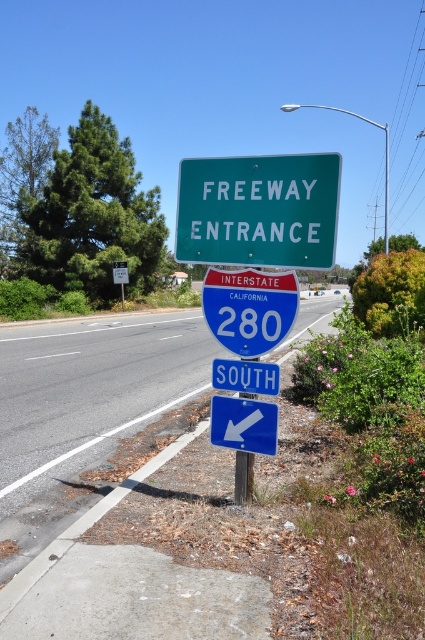
Does green matte freeway entrance sign at upper center come in front of blue glossy arrow at lower center?

No, it is not.

Which is more to the right, green matte freeway entrance sign at upper center or blue glossy arrow at lower center?

blue glossy arrow at lower center is more to the right.

Identify the location of green matte freeway entrance sign at upper center. (258, 211).

Is point (227, 317) positioned in front of point (240, 396)?

Yes, point (227, 317) is closer to viewer.

Can you confirm if blue glossy interstate sign at center is positioned below metallic pole at center?

Actually, blue glossy interstate sign at center is above metallic pole at center.

Is point (265, 296) closer to viewer compared to point (237, 486)?

Yes.

At what (x,y) coordinates should I click in order to perform the action: click on blue glossy interstate sign at center. Please return your answer as a coordinate pair (x, y). This screenshot has height=640, width=425. Looking at the image, I should click on (249, 308).

Does green matte freeway entrance sign at upper center have a larger size compared to blue glossy interstate sign at center?

No.

Does green matte freeway entrance sign at upper center have a greater width compared to blue glossy interstate sign at center?

Incorrect, green matte freeway entrance sign at upper center's width does not surpass blue glossy interstate sign at center's.

Is point (334, 172) closer to camera compared to point (289, 280)?

Yes, it is.

The height and width of the screenshot is (640, 425). Find the location of `green matte freeway entrance sign at upper center`. green matte freeway entrance sign at upper center is located at coordinates (258, 211).